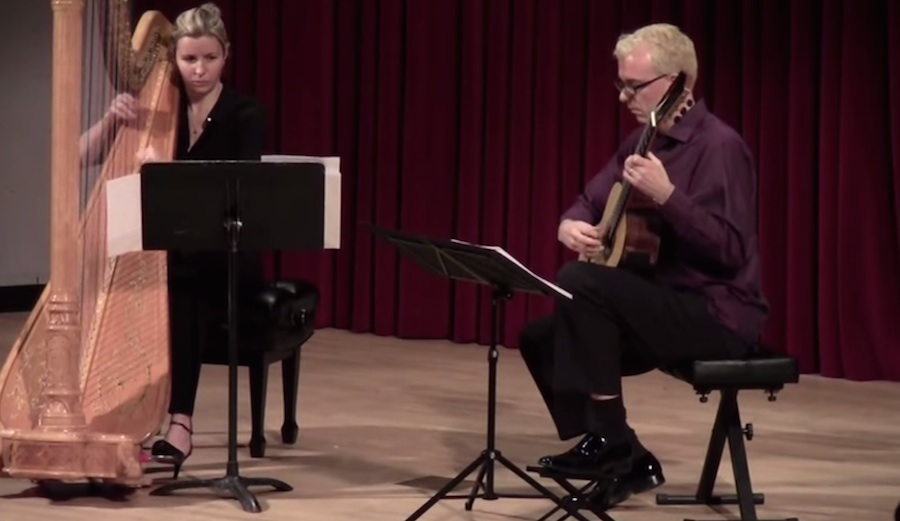
Where is `music stand`? The height and width of the screenshot is (521, 900). music stand is located at coordinates (460, 268).